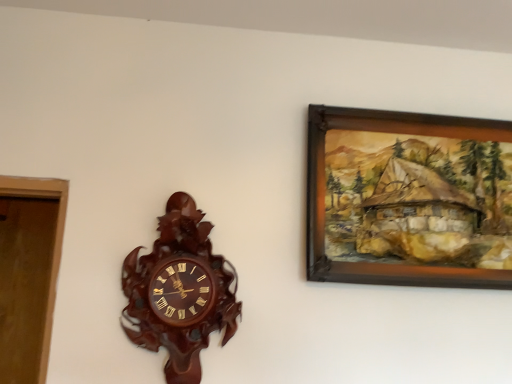
Question: Would you say wooden carved clock at center-left is inside or outside wooden picture frame at upper right?

Choices:
 (A) inside
 (B) outside

Answer: (B)

Question: Considering their positions, is wooden carved clock at center-left located in front of or behind wooden picture frame at upper right?

Choices:
 (A) behind
 (B) front

Answer: (B)

Question: From a real-world perspective, is wooden carved clock at center-left physically located above or below wooden picture frame at upper right?

Choices:
 (A) below
 (B) above

Answer: (A)

Question: From a real-world perspective, relative to wooden carved clock at center-left, is wooden picture frame at upper right vertically above or below?

Choices:
 (A) above
 (B) below

Answer: (A)

Question: In the image, is wooden picture frame at upper right positioned in front of or behind wooden carved clock at center-left?

Choices:
 (A) behind
 (B) front

Answer: (A)

Question: Considering the relative positions of wooden picture frame at upper right and wooden carved clock at center-left in the image provided, is wooden picture frame at upper right to the left or to the right of wooden carved clock at center-left?

Choices:
 (A) left
 (B) right

Answer: (B)

Question: From the image's perspective, is wooden picture frame at upper right above or below wooden carved clock at center-left?

Choices:
 (A) below
 (B) above

Answer: (B)